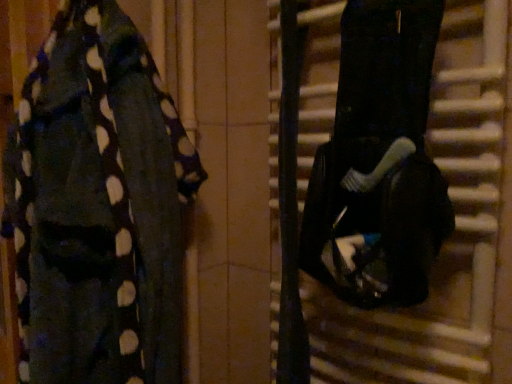
Locate an element on the screen. The image size is (512, 384). black matte guitar case at right is located at coordinates (379, 161).

What do you see at coordinates (379, 161) in the screenshot? I see `black matte guitar case at right` at bounding box center [379, 161].

In order to face polka dot fabric at left, should I rotate leftwards or rightwards?

A 19.345 degree turn to the left will do.

This screenshot has width=512, height=384. In order to click on polka dot fabric at left in this screenshot , I will do `click(97, 205)`.

What do you see at coordinates (97, 205) in the screenshot? Image resolution: width=512 pixels, height=384 pixels. I see `polka dot fabric at left` at bounding box center [97, 205].

The width and height of the screenshot is (512, 384). Identify the location of black matte guitar case at right. (379, 161).

Considering the positions of objects polka dot fabric at left and black matte guitar case at right in the image provided, who is more to the right, polka dot fabric at left or black matte guitar case at right?

black matte guitar case at right is more to the right.

Consider the image. Is the depth of polka dot fabric at left less than that of black matte guitar case at right?

Yes, polka dot fabric at left is in front of black matte guitar case at right.

Is point (135, 67) more distant than point (315, 245)?

That is True.

From the image's perspective, is polka dot fabric at left above or below black matte guitar case at right?

Clearly, from the image's perspective, polka dot fabric at left is below black matte guitar case at right.

Looking at this image, from a real-world perspective, is polka dot fabric at left beneath black matte guitar case at right?

Indeed, from a real-world perspective, polka dot fabric at left is positioned beneath black matte guitar case at right.

Consider the image. Which object is wider, polka dot fabric at left or black matte guitar case at right?

Wider between the two is polka dot fabric at left.

Between polka dot fabric at left and black matte guitar case at right, which one has more height?

polka dot fabric at left is taller.

Considering the sizes of objects polka dot fabric at left and black matte guitar case at right in the image provided, who is smaller, polka dot fabric at left or black matte guitar case at right?

black matte guitar case at right.

Can we say polka dot fabric at left lies outside black matte guitar case at right?

Yes, polka dot fabric at left is located beyond the bounds of black matte guitar case at right.

Is polka dot fabric at left positioned far away from black matte guitar case at right?

No, there isn't a large distance between polka dot fabric at left and black matte guitar case at right.

Does polka dot fabric at left turn towards black matte guitar case at right?

No.

Find the location of `wide positioned vertically above the polka dot fabric at left (from a real-world perspective)`. wide positioned vertically above the polka dot fabric at left (from a real-world perspective) is located at coordinates (379, 161).

Is black matte guitar case at right to the right of polka dot fabric at left from the viewer's perspective?

Yes.

From the picture: Which object is closer to the camera taking this photo, black matte guitar case at right or polka dot fabric at left?

polka dot fabric at left is more forward.

Is point (349, 17) closer or farther from the camera than point (123, 368)?

Point (349, 17) appears to be farther away from the viewer than point (123, 368).

From the image's perspective, is black matte guitar case at right beneath polka dot fabric at left?

Actually, black matte guitar case at right appears above polka dot fabric at left in the image.

From a real-world perspective, between black matte guitar case at right and polka dot fabric at left, who is vertically lower?

In real-world perspective, polka dot fabric at left is lower.

Which object is thinner, black matte guitar case at right or polka dot fabric at left?

Thinner between the two is black matte guitar case at right.

Considering the sizes of black matte guitar case at right and polka dot fabric at left in the image, is black matte guitar case at right taller or shorter than polka dot fabric at left?

Clearly, black matte guitar case at right is shorter compared to polka dot fabric at left.

Looking at the image, does black matte guitar case at right seem bigger or smaller compared to polka dot fabric at left?

Clearly, black matte guitar case at right is smaller in size than polka dot fabric at left.

Do you think black matte guitar case at right is within polka dot fabric at left, or outside of it?

black matte guitar case at right cannot be found inside polka dot fabric at left.

Is there a large distance between black matte guitar case at right and polka dot fabric at left?

black matte guitar case at right is actually quite close to polka dot fabric at left.

Is black matte guitar case at right oriented towards polka dot fabric at left?

No, black matte guitar case at right is not aimed at polka dot fabric at left.

Image resolution: width=512 pixels, height=384 pixels. Identify the location of wide above the polka dot fabric at left (from a real-world perspective). (379, 161).

Where is `wide above the polka dot fabric at left (from the image's perspective)`? The image size is (512, 384). wide above the polka dot fabric at left (from the image's perspective) is located at coordinates (379, 161).

Find the location of a particular element. The height and width of the screenshot is (384, 512). wide on the right of polka dot fabric at left is located at coordinates (379, 161).